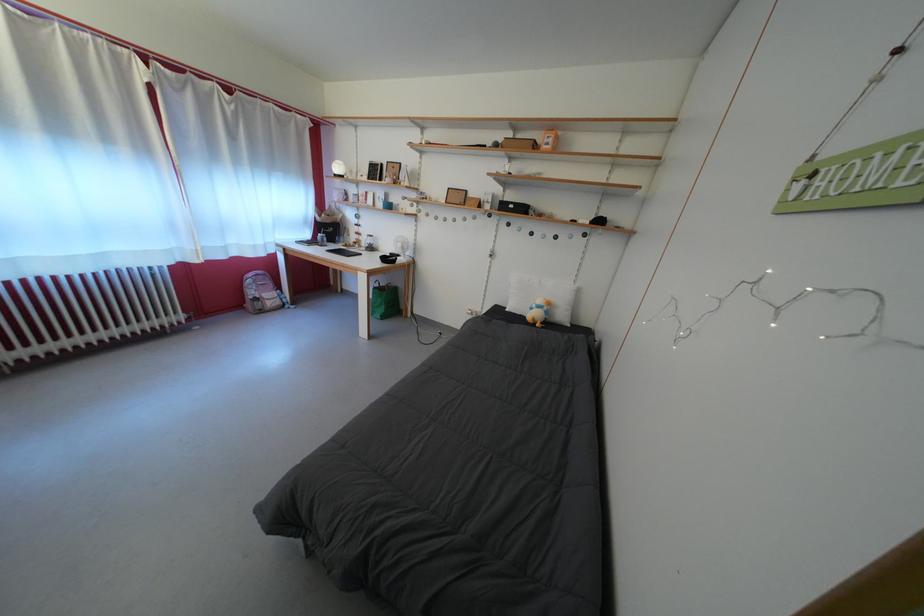
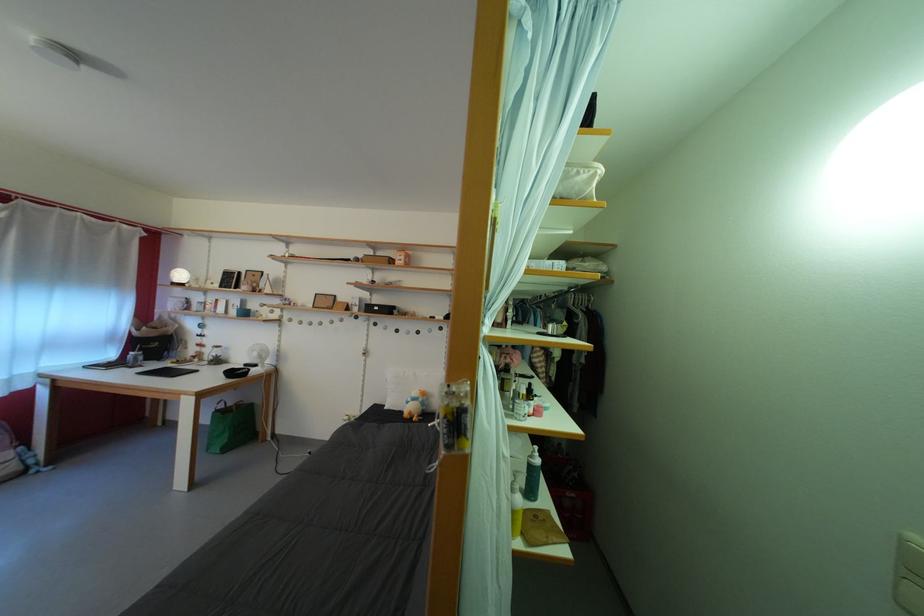
Where in the second image is the point corresponding to point 542,312 from the first image?

(418, 405)